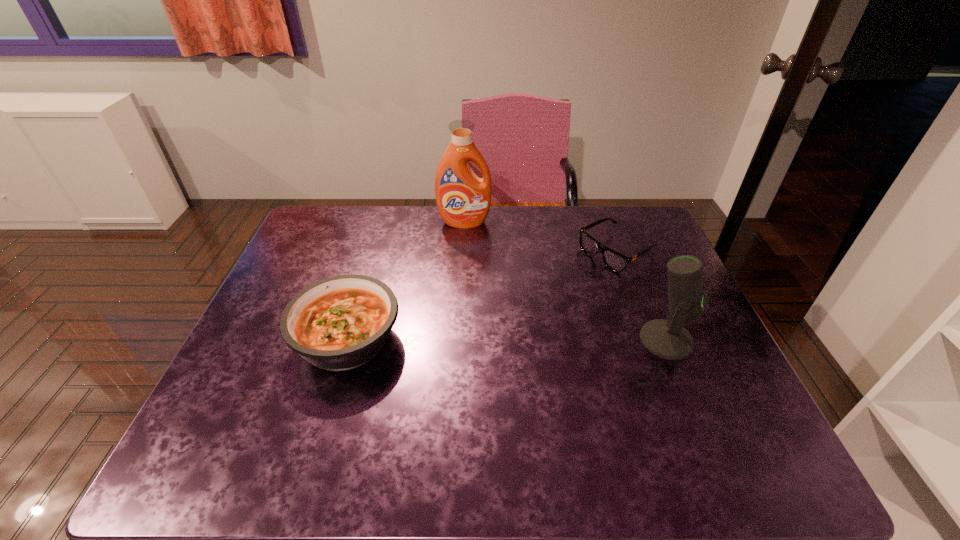
Identify the location of object at the far right corner. This screenshot has height=540, width=960. (613, 260).

In the image, there is a desktop. In order to click on vacant space at the far edge in this screenshot , I will do `click(445, 245)`.

In the image, there is a desktop. Identify the location of vacant space at the near edge. (616, 421).

In the image, there is a desktop. At what (x,y) coordinates should I click in order to perform the action: click on vacant space at the left edge. Please return your answer as a coordinate pair (x, y). The image size is (960, 540). Looking at the image, I should click on (292, 293).

Locate an element on the screen. free space at the right edge of the desktop is located at coordinates (735, 379).

The height and width of the screenshot is (540, 960). In order to click on blank space at the far left corner in this screenshot , I will do `click(328, 225)`.

This screenshot has height=540, width=960. I want to click on vacant space at the near left corner of the desktop, so click(242, 407).

Find the location of a particular element. vacant region at the far right corner of the desktop is located at coordinates click(x=602, y=213).

In the image, there is a desktop. Where is `vacant space at the near right corner`? The height and width of the screenshot is (540, 960). vacant space at the near right corner is located at coordinates (726, 404).

The image size is (960, 540). I want to click on free space that is in between the tallest object and the stew, so click(406, 280).